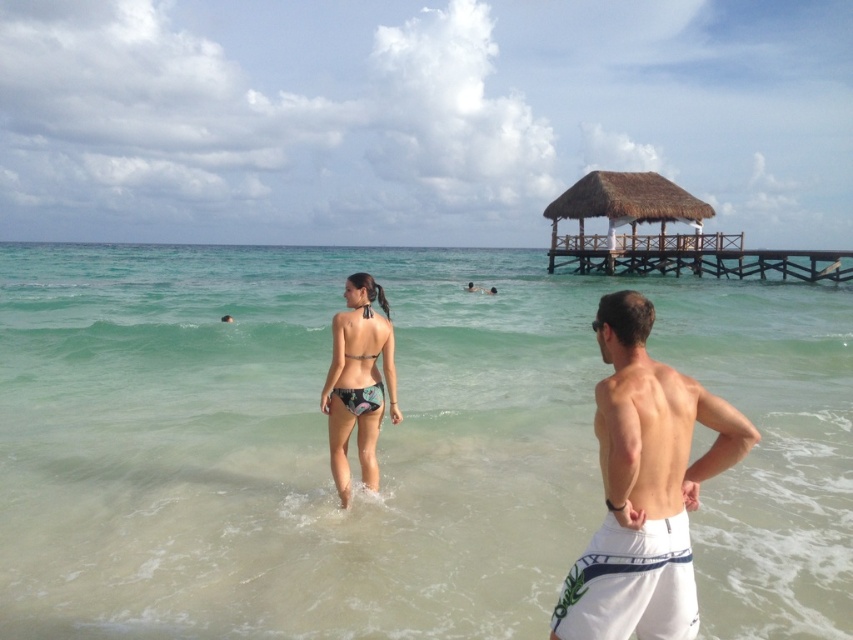
Question: Which of the following is the farthest from the observer?

Choices:
 (A) floral print bikini at center
 (B) thatched wood hut at upper center
 (C) brown wooden dock at upper right
 (D) white textured shorts at right

Answer: (B)

Question: Considering the real-world distances, which object is farthest from the brown wooden dock at upper right?

Choices:
 (A) white textured shorts at right
 (B) printed fabric bikini at center
 (C) thatched wood hut at upper center

Answer: (A)

Question: Observing the image, what is the correct spatial positioning of clear water at center in reference to brown wooden dock at upper right?

Choices:
 (A) below
 (B) above

Answer: (A)

Question: Does white textured shorts at right have a smaller size compared to thatched wood hut at upper center?

Choices:
 (A) yes
 (B) no

Answer: (A)

Question: Can you confirm if brown wooden dock at upper right is positioned below thatched wood hut at upper center?

Choices:
 (A) yes
 (B) no

Answer: (A)

Question: Which object appears farthest from the camera in this image?

Choices:
 (A) thatched wood hut at upper center
 (B) clear water at center

Answer: (A)